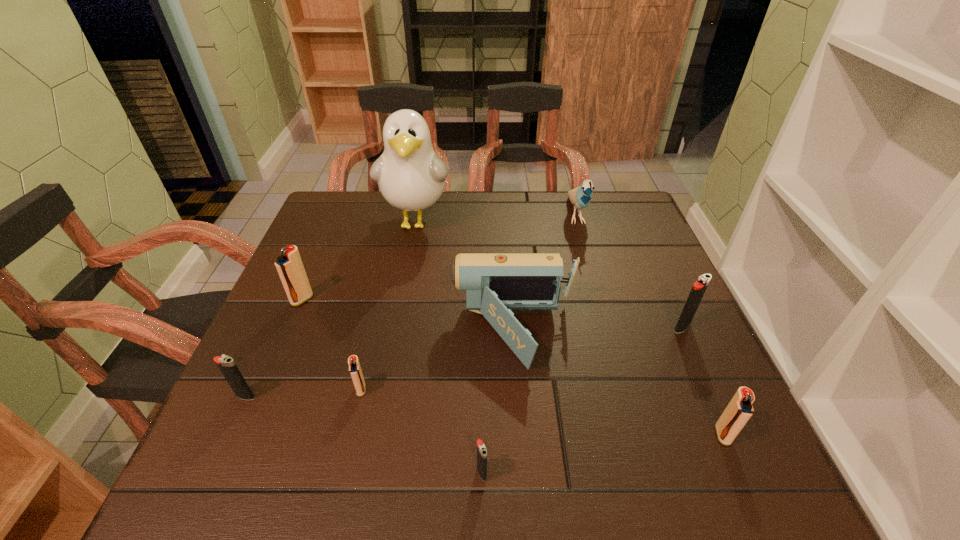
The height and width of the screenshot is (540, 960). I want to click on red igniter that stands as the closest to the second nearest red igniter, so click(x=290, y=268).

Identify the location of black igniter that is the second nearest to the leftmost red igniter. (481, 448).

Find the location of a particular element. This screenshot has width=960, height=540. the closest black igniter to the second smallest black igniter is located at coordinates (481, 448).

Image resolution: width=960 pixels, height=540 pixels. Find the location of `free space in the image that satisfies the following two spatial constraints: 1. on the front side of the nearest black igniter; 2. on the left side of the smallest red igniter`. free space in the image that satisfies the following two spatial constraints: 1. on the front side of the nearest black igniter; 2. on the left side of the smallest red igniter is located at coordinates (342, 472).

Identify the location of free space that satisfies the following two spatial constraints: 1. on the beak of the tallest object; 2. on the right side of the nearest red igniter. (377, 435).

At what (x,y) coordinates should I click in order to perform the action: click on free space that satisfies the following two spatial constraints: 1. on the front side of the eighth farthest object; 2. on the left side of the second red igniter from right to left. Please return your answer as a coordinate pair (x, y). Image resolution: width=960 pixels, height=540 pixels. Looking at the image, I should click on (350, 435).

Find the location of a particular element. Image resolution: width=960 pixels, height=540 pixels. free point that satisfies the following two spatial constraints: 1. at the face of the rightmost black igniter; 2. on the left side of the bird is located at coordinates (608, 328).

You are a GUI agent. You are given a task and a screenshot of the screen. Output one action in this format:
    pyautogui.click(x=<x>, y=<y>)
    Task: Click on the vacant space that satisfies the following two spatial constraints: 1. at the face of the blue bird; 2. on the side of the camcorder with the flip-out screen
    
    Given the screenshot: What is the action you would take?
    (x=610, y=333)

You are a GUI agent. You are given a task and a screenshot of the screen. Output one action in this format:
    pyautogui.click(x=<x>, y=<y>)
    Task: Click on the free region that satisfies the following two spatial constraints: 1. at the face of the fifth nearest igniter; 2. on the left side of the blue bird
    
    Given the screenshot: What is the action you would take?
    pyautogui.click(x=608, y=328)